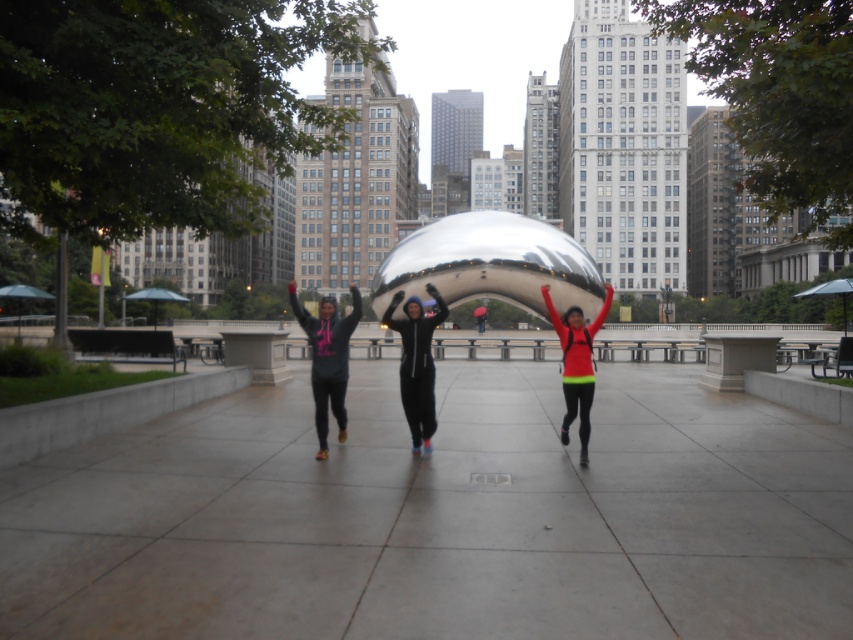
From the picture: Between matte black hoodie at center and neon green jacket at center, which one appears on the left side from the viewer's perspective?

matte black hoodie at center is more to the left.

Does matte black hoodie at center have a lesser width compared to neon green jacket at center?

No, matte black hoodie at center is not thinner than neon green jacket at center.

Is point (318, 420) more distant than point (483, 326)?

No, (318, 420) is closer to viewer.

Locate an element on the screen. The width and height of the screenshot is (853, 640). matte black hoodie at center is located at coordinates (328, 358).

Between gray concrete pavement at center and neon green fabric at center, which one has more height?

neon green fabric at center

Find the location of a particular element. gray concrete pavement at center is located at coordinates pos(440,516).

Between black matte hoodie at center and neon green fabric at center, which one is positioned higher?

neon green fabric at center is higher up.

Who is more forward, (421, 316) or (572, 355)?

Point (572, 355) is more forward.

Measure the distance between black matte hoodie at center and camera.

A distance of 25.58 feet exists between black matte hoodie at center and camera.

Where is `black matte hoodie at center`? This screenshot has height=640, width=853. black matte hoodie at center is located at coordinates pos(416,364).